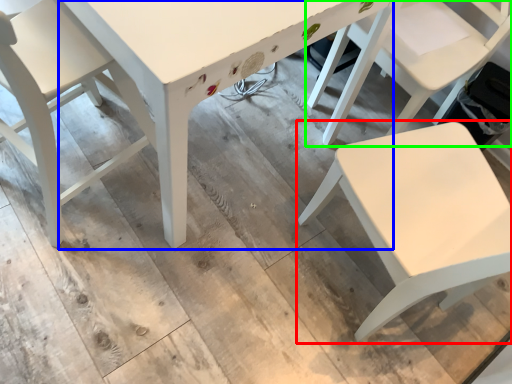
Question: Which object is the closest to the chair (highlighted by a red box)? Choose among these: table (highlighted by a blue box) or chair (highlighted by a green box).

Choices:
 (A) table
 (B) chair

Answer: (B)